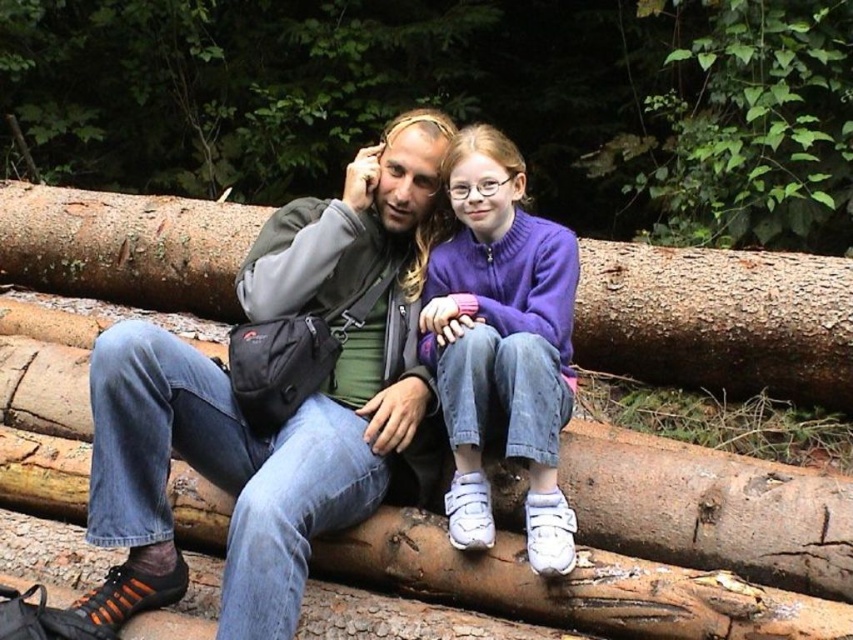
You are a photographer trying to capture a candid shot of the denim jeans at center and the purple fleece sweater at center. Since you want to highlight both items equally in your photo, which clothing item should you zoom in on more to ensure they appear the same size in the final image?

The denim jeans at center is bigger than the purple fleece sweater at center. To make them appear the same size in the photo, you should zoom in more on the denim jeans at center to reduce its size in the frame while keeping the purple fleece sweater at center at a standard zoom.

You are a hiker who wants to sit on the brown rough log at center. However, your backpack is the same height as the purple fleece sweater at center. Do you think your backpack will fit on the log?

The brown rough log at center is much taller than the purple fleece sweater at center. Since your backpack is the same height as the purple fleece sweater at center, it should fit comfortably on the log without any issues.